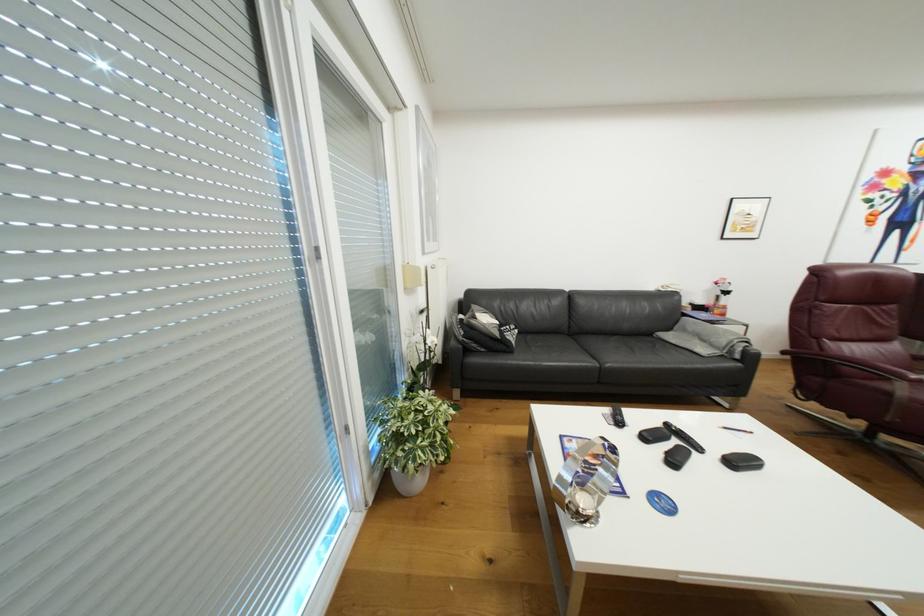
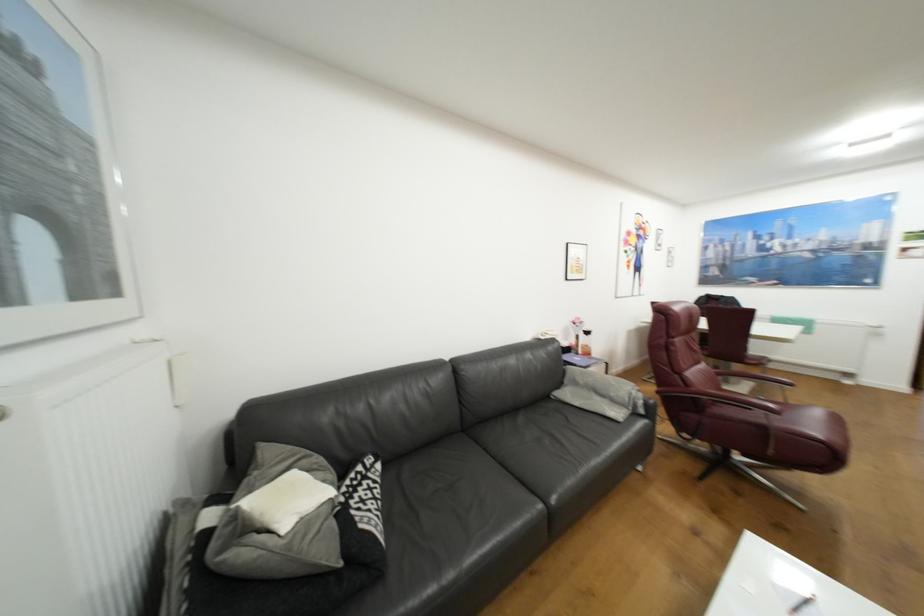
Find the pixel in the second image that matches pixel 604 365 in the first image.

(548, 506)